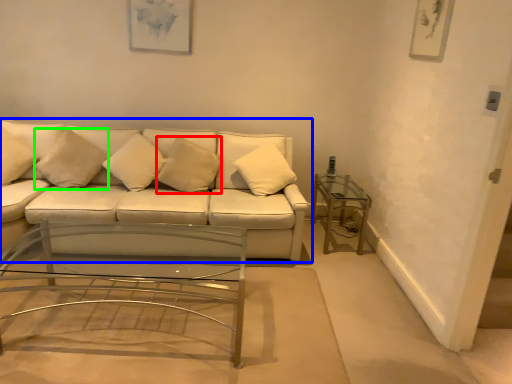
Question: Which object is positioned closest to pillow (highlighted by a red box)? Select from studio couch (highlighted by a blue box) and pillow (highlighted by a green box).

Choices:
 (A) studio couch
 (B) pillow

Answer: (A)